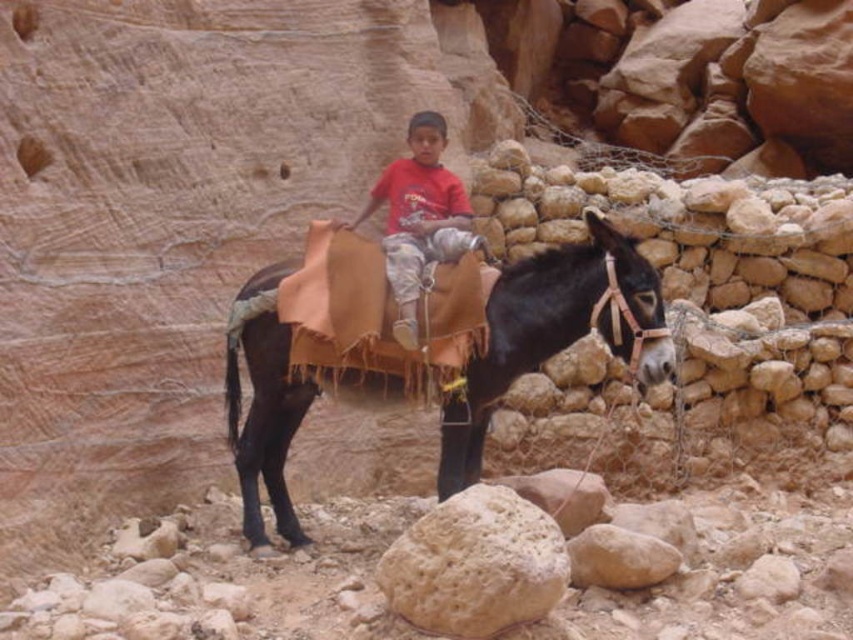
Question: Which point is farther from the camera taking this photo?

Choices:
 (A) tap(250, 515)
 (B) tap(480, 525)
 (C) tap(402, 346)

Answer: (A)

Question: Is shiny brown saddle at center above matte red shirt at center?

Choices:
 (A) no
 (B) yes

Answer: (A)

Question: Observing the image, what is the correct spatial positioning of shiny brown saddle at center in reference to matte red shirt at center?

Choices:
 (A) left
 (B) right

Answer: (B)

Question: Which of the following is the farthest from the observer?

Choices:
 (A) (643, 564)
 (B) (488, 388)
 (C) (405, 340)

Answer: (B)

Question: Is smooth beige rock at lower center smaller than smooth beige rock at center?

Choices:
 (A) yes
 (B) no

Answer: (B)

Question: Which point is closer to the camera?

Choices:
 (A) matte red shirt at center
 (B) shiny brown saddle at center
 (C) smooth beige rock at center
 (D) smooth beige rock at lower center

Answer: (D)